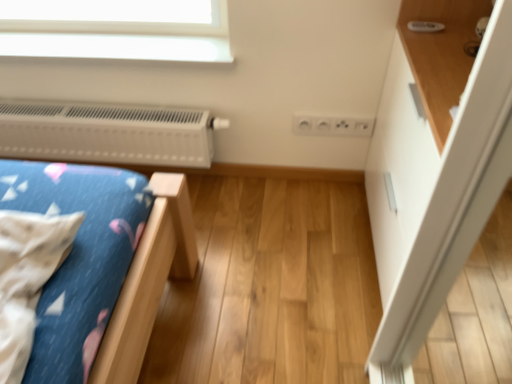
Question: From the image's perspective, is white plastic heater at upper left above or below white glossy dresser at upper right?

Choices:
 (A) below
 (B) above

Answer: (B)

Question: From a real-world perspective, is white plastic heater at upper left above or below white glossy dresser at upper right?

Choices:
 (A) below
 (B) above

Answer: (A)

Question: Which is farther from the white plastic heater at upper left?

Choices:
 (A) white glossy dresser at upper right
 (B) wooden shelf at upper right

Answer: (B)

Question: Which is farther from the wooden shelf at upper right?

Choices:
 (A) white plastic heater at upper left
 (B) white glossy dresser at upper right

Answer: (A)